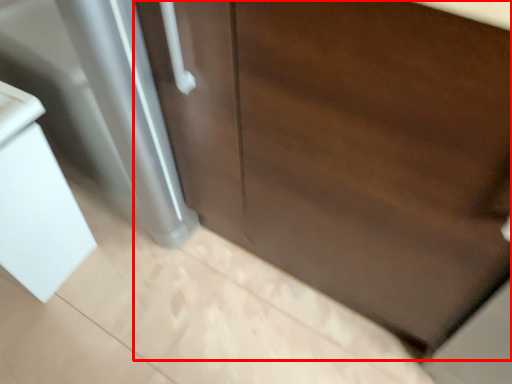
Question: Observing the image, what is the correct spatial positioning of door (annotated by the red box) in reference to sink?

Choices:
 (A) left
 (B) right

Answer: (B)